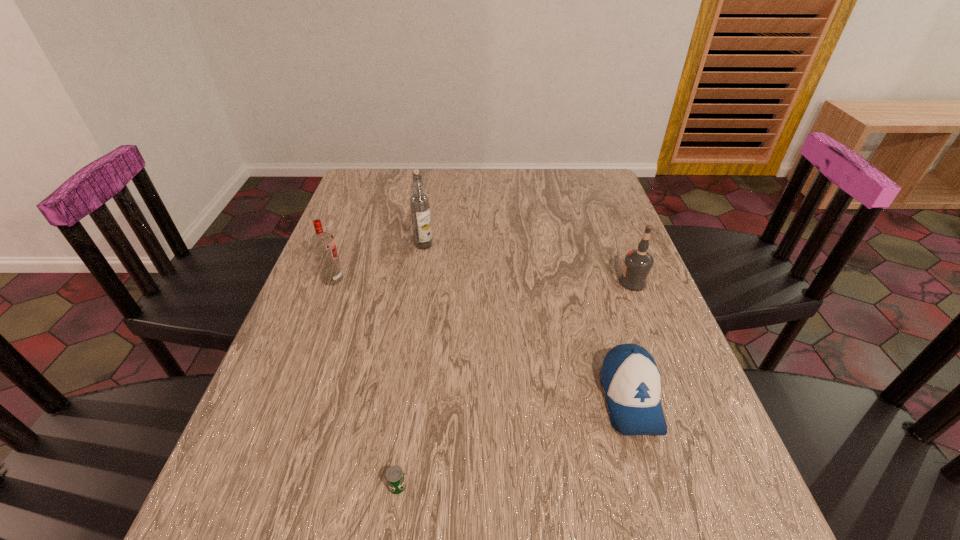
The height and width of the screenshot is (540, 960). I want to click on vacant space at the near edge of the desktop, so click(407, 525).

In the image, there is a desktop. Where is `free region at the left edge`? Image resolution: width=960 pixels, height=540 pixels. free region at the left edge is located at coordinates (328, 358).

This screenshot has height=540, width=960. I want to click on vacant space at the right edge of the desktop, so click(619, 240).

The width and height of the screenshot is (960, 540). I want to click on vacant space at the far left corner of the desktop, so click(356, 183).

This screenshot has width=960, height=540. Identify the location of vacant space at the near left corner of the desktop. (257, 526).

You are a GUI agent. You are given a task and a screenshot of the screen. Output one action in this format:
    pyautogui.click(x=<x>, y=<y>)
    Task: Click on the free space at the near right corner of the desktop
    This screenshot has height=540, width=960.
    Given the screenshot: What is the action you would take?
    pyautogui.click(x=657, y=535)

At what (x,y) coordinates should I click in order to perform the action: click on vacant region between the baseball cap and the second vodka from right to left. Please return your answer as a coordinate pair (x, y). This screenshot has height=540, width=960. Looking at the image, I should click on (527, 322).

Where is `free area in between the leftmost object and the baseball cap`? This screenshot has width=960, height=540. free area in between the leftmost object and the baseball cap is located at coordinates (482, 339).

You are a GUI agent. You are given a task and a screenshot of the screen. Output one action in this format:
    pyautogui.click(x=<x>, y=<y>)
    Task: Click on the empty space that is in between the shortest object and the baseball cap
    
    Given the screenshot: What is the action you would take?
    pyautogui.click(x=515, y=442)

Find the location of `vacant space that is in between the rightmost vodka and the beer can`. vacant space that is in between the rightmost vodka and the beer can is located at coordinates (516, 384).